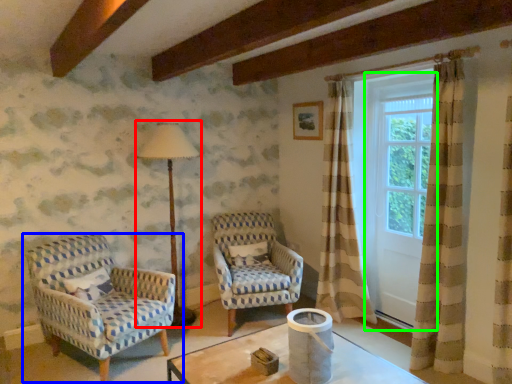
Question: Which object is positioned farthest from table lamp (highlighted by a red box)? Select from chair (highlighted by a blue box) and screen door (highlighted by a green box).

Choices:
 (A) chair
 (B) screen door

Answer: (B)